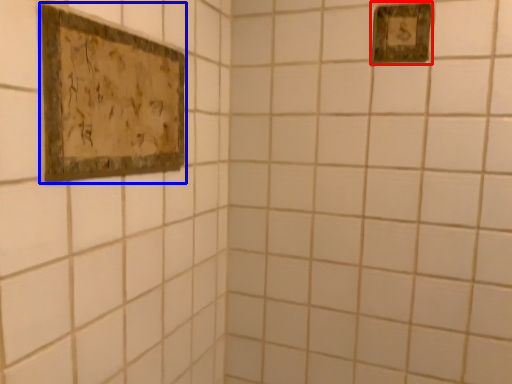
Question: Which object appears farthest to the camera in this image, picture frame (highlighted by a red box) or picture frame (highlighted by a blue box)?

Choices:
 (A) picture frame
 (B) picture frame

Answer: (A)